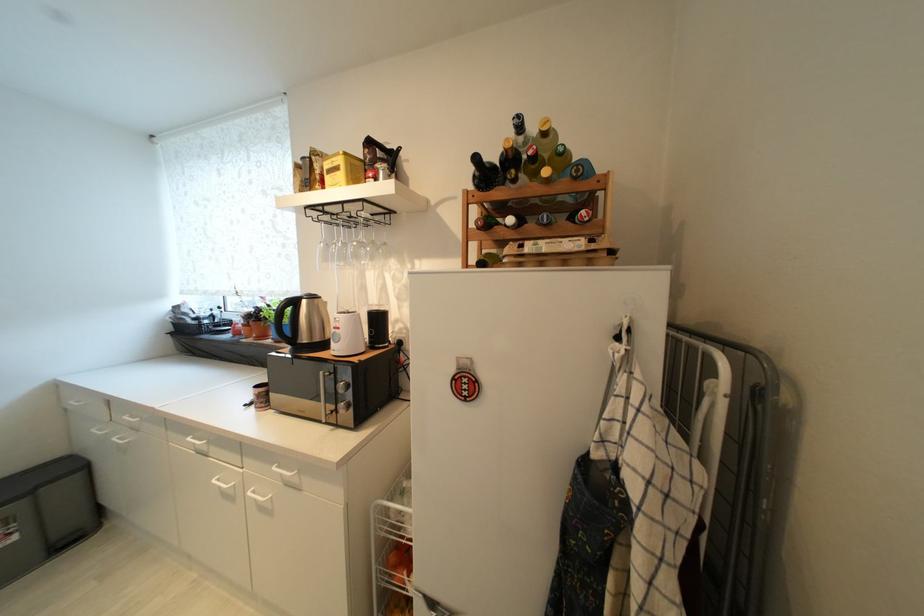
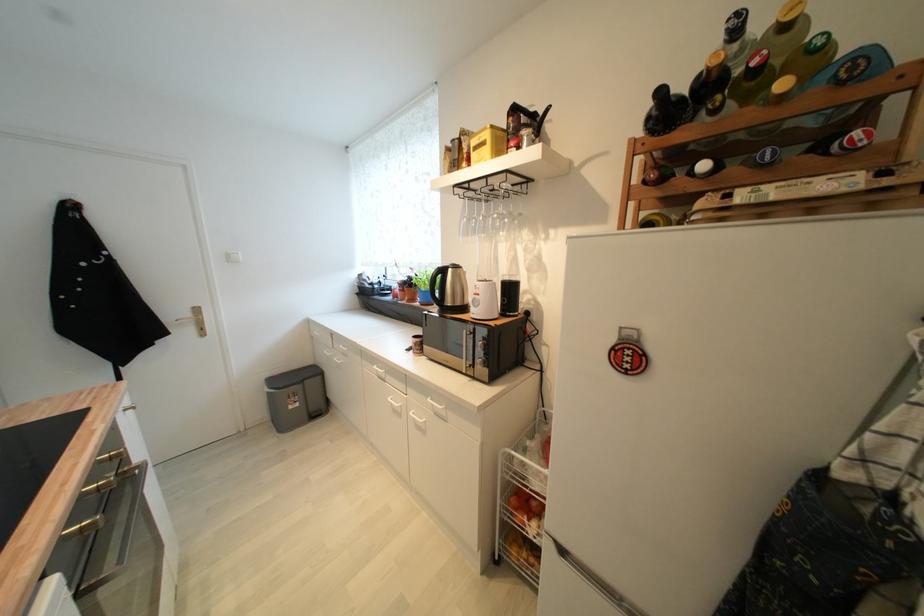
The point at (477, 227) is marked in the first image. Where is the corresponding point in the second image?

(641, 182)